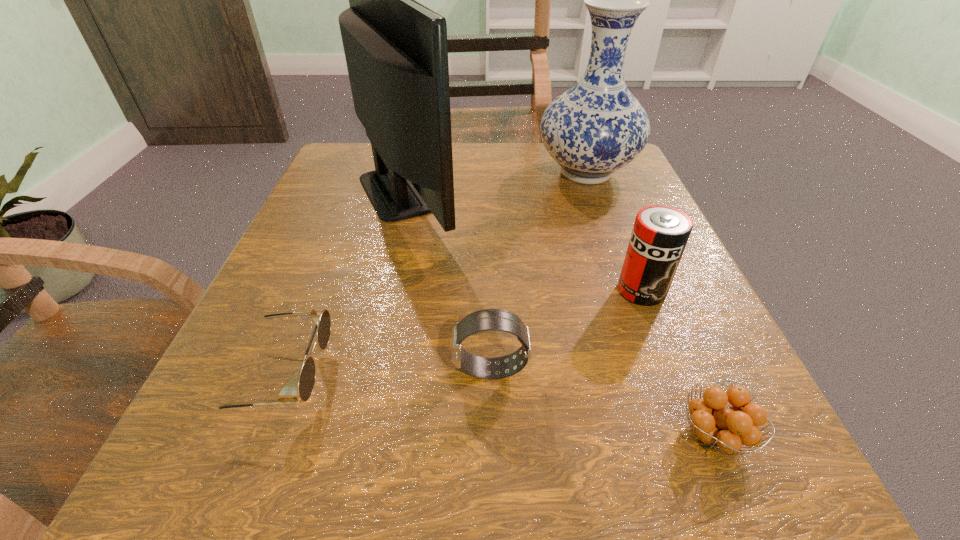
The height and width of the screenshot is (540, 960). Identify the location of free spot located on the front of the third tallest object. (731, 517).

Where is `free space located 0.160m on the face of the third object from left to right`? This screenshot has width=960, height=540. free space located 0.160m on the face of the third object from left to right is located at coordinates (330, 369).

At what (x,y) coordinates should I click in order to perform the action: click on vacant space situated 0.150m on the face of the third object from left to right. Please return your answer as a coordinate pair (x, y). The height and width of the screenshot is (540, 960). Looking at the image, I should click on (338, 369).

You are a GUI agent. You are given a task and a screenshot of the screen. Output one action in this format:
    pyautogui.click(x=<x>, y=<y>)
    Task: Click on the free space located on the face of the third object from left to right
    
    Given the screenshot: What is the action you would take?
    pyautogui.click(x=260, y=369)

What are the coordinates of `vacant region located on the front lenses of the sunglasses` in the screenshot? It's located at (637, 375).

Image resolution: width=960 pixels, height=540 pixels. Identify the location of free spot located 0.280m on the left of the orange fruit. (433, 435).

Locate an element on the screen. The height and width of the screenshot is (540, 960). computer monitor at the far edge is located at coordinates (396, 50).

Identify the location of vase that is positioned at the far edge. Image resolution: width=960 pixels, height=540 pixels. (597, 127).

The width and height of the screenshot is (960, 540). Find the location of `object situated at the near edge`. object situated at the near edge is located at coordinates (726, 428).

Where is `computer monitor that is at the left edge`? The height and width of the screenshot is (540, 960). computer monitor that is at the left edge is located at coordinates (396, 50).